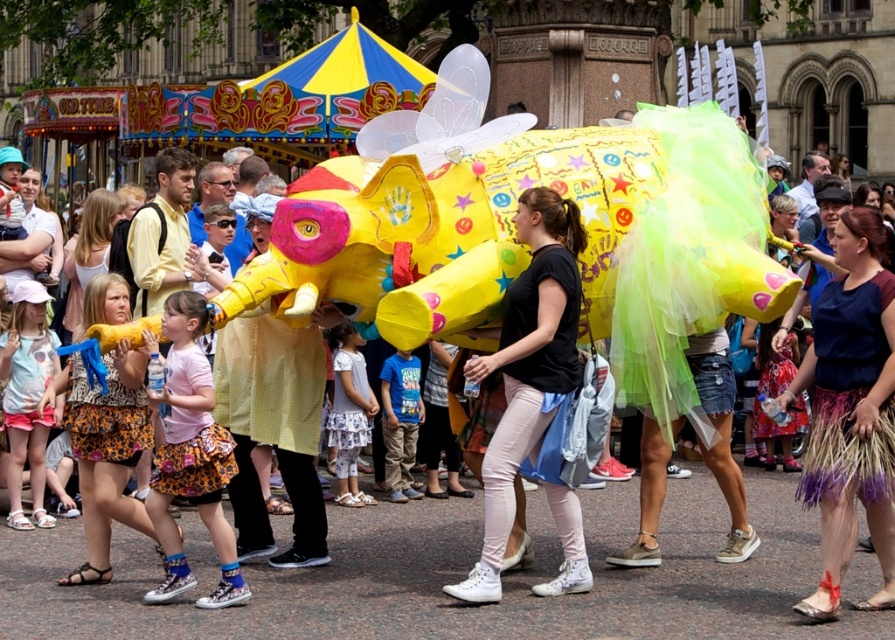
From the picture: You are a photographer at the parade and want to capture both the white cotton dress at center and the blue cotton shirt at center in a single frame. Which clothing item is shorter in height?

The white cotton dress at center has a lesser height compared to the blue cotton shirt at center, so the white cotton dress at center is shorter in height.